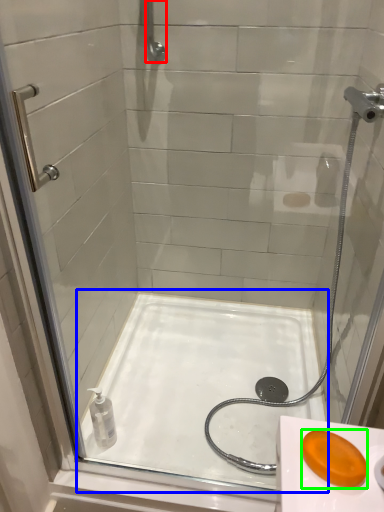
Question: Estimate the real-world distances between objects in this image. Which object is closer to shower (highlighted by a red box), bath (highlighted by a blue box) or soap (highlighted by a green box)?

Choices:
 (A) bath
 (B) soap

Answer: (A)